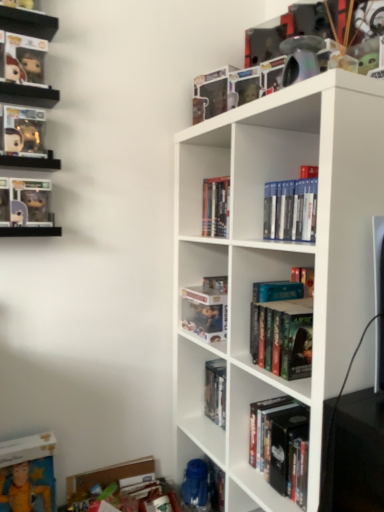
Question: Is translucent plastic figure at upper center, placed as the third book when sorted from left to right, to the right of hardcover book at center, the fifth book from the left, from the viewer's perspective?

Choices:
 (A) no
 (B) yes

Answer: (A)

Question: Considering the relative sizes of translucent plastic figure at upper center, the sixth book viewed from the right, and hardcover book at center, the fifth book from the left, in the image provided, is translucent plastic figure at upper center, the sixth book viewed from the right, bigger than hardcover book at center, the fifth book from the left,?

Choices:
 (A) no
 (B) yes

Answer: (B)

Question: From the image's perspective, is translucent plastic figure at upper center, placed as the third book when sorted from left to right, located above hardcover book at center, the fifth book from the left?

Choices:
 (A) yes
 (B) no

Answer: (A)

Question: Is the surface of translucent plastic figure at upper center, the sixth book viewed from the right, in direct contact with hardcover book at center, which is the fourth book from right to left?

Choices:
 (A) no
 (B) yes

Answer: (A)

Question: Is translucent plastic figure at upper center, placed as the third book when sorted from left to right, thinner than hardcover book at center, the fifth book from the left?

Choices:
 (A) yes
 (B) no

Answer: (B)

Question: Is translucent plastic figure at upper center, the sixth book viewed from the right, wider than hardcover book at center, which is the fourth book from right to left?

Choices:
 (A) no
 (B) yes

Answer: (B)

Question: Is the position of hardcover books at center, the 4th book positioned from the left, more distant than that of matte gold figurine at upper left, placed as the 1th book when sorted from left to right?

Choices:
 (A) no
 (B) yes

Answer: (B)

Question: Would you say hardcover books at center, the fifth book viewed from the right, is outside matte gold figurine at upper left, which is counted as the eighth book, starting from the right?

Choices:
 (A) yes
 (B) no

Answer: (A)

Question: From the image's perspective, is hardcover books at center, the 4th book positioned from the left, below matte gold figurine at upper left, placed as the 1th book when sorted from left to right?

Choices:
 (A) yes
 (B) no

Answer: (A)

Question: Does hardcover books at center, the 4th book positioned from the left, have a larger size compared to matte gold figurine at upper left, which is counted as the eighth book, starting from the right?

Choices:
 (A) no
 (B) yes

Answer: (B)

Question: Is hardcover books at center, the fifth book viewed from the right, at the left side of matte gold figurine at upper left, placed as the 1th book when sorted from left to right?

Choices:
 (A) no
 (B) yes

Answer: (A)

Question: Is hardcover books at center, the 4th book positioned from the left, oriented away from matte gold figurine at upper left, placed as the 1th book when sorted from left to right?

Choices:
 (A) no
 (B) yes

Answer: (A)

Question: Does metallic rainbow pipe at upper right have a greater width compared to clear plastic figurines at upper left, the second shelf positioned from the bottom?

Choices:
 (A) no
 (B) yes

Answer: (A)